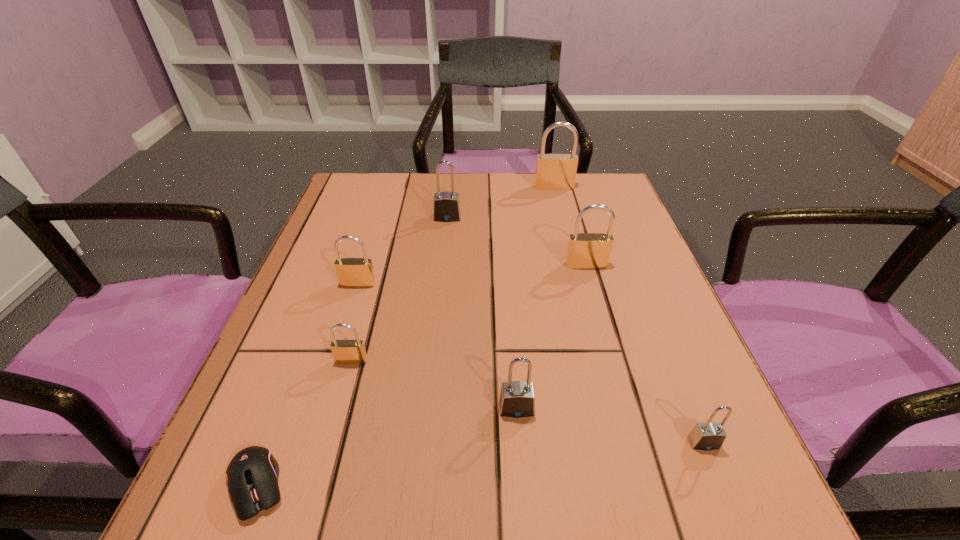
At what (x,y) coordinates should I click in order to perform the action: click on the seventh farthest object. Please return your answer as a coordinate pair (x, y). Looking at the image, I should click on (706, 436).

At what (x,y) coordinates should I click in order to perform the action: click on the rightmost gray padlock. Please return your answer as a coordinate pair (x, y). This screenshot has height=540, width=960. Looking at the image, I should click on (706, 436).

Where is `the smallest brass padlock`? This screenshot has height=540, width=960. the smallest brass padlock is located at coordinates (344, 351).

Where is `the nearest brass padlock`? the nearest brass padlock is located at coordinates (344, 351).

At what (x,y) coordinates should I click in order to perform the action: click on the nearest object. Please return your answer as a coordinate pair (x, y). This screenshot has width=960, height=540. Looking at the image, I should click on (252, 475).

Find the location of a particular element. computer mouse is located at coordinates (252, 475).

Find the location of a particular element. blank area located on the front-facing side of the tallest padlock is located at coordinates (559, 204).

Image resolution: width=960 pixels, height=540 pixels. Identify the location of vacant region located on the shackle of the second farthest object. (445, 240).

Find the location of a particular element. vacant space located 0.120m on the front-facing side of the second farthest brass padlock is located at coordinates (599, 310).

Locate an element on the screen. vacant space located on the shackle of the fifth object from left to right is located at coordinates (525, 534).